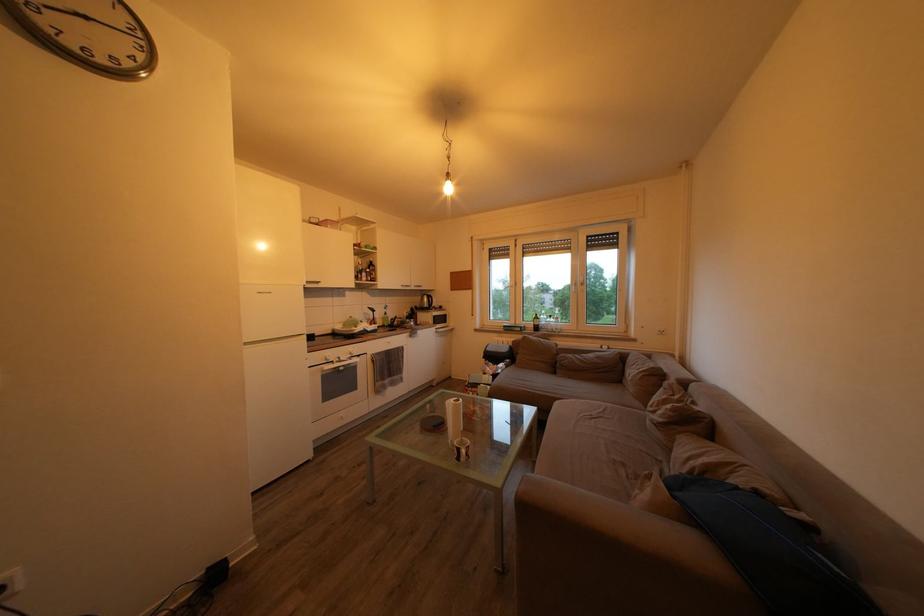
Where would you pull the white window handle? Please return your answer as a coordinate pair (x, y).

(590, 282)